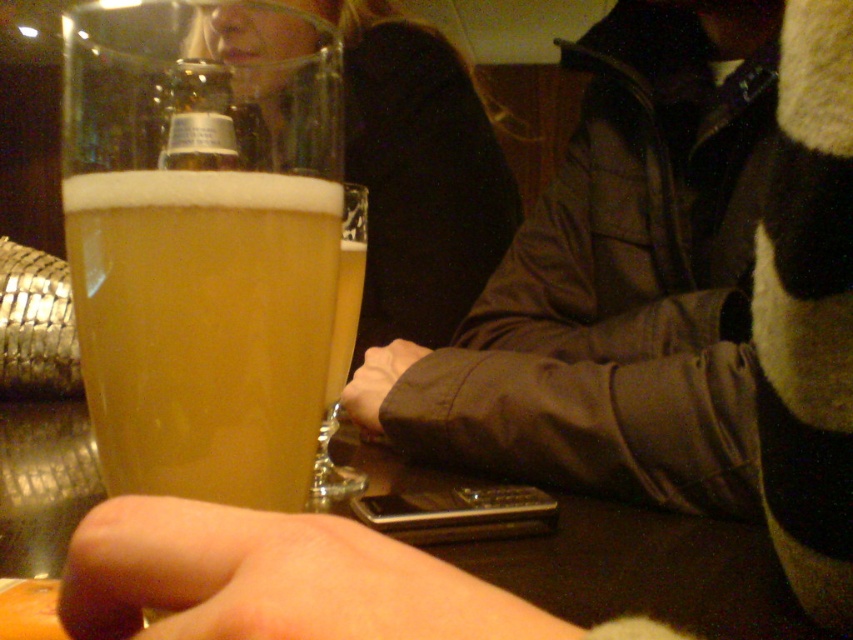
Question: Which point is closer to the camera?

Choices:
 (A) matte black hand at center
 (B) golden matte glass at center
 (C) skinny flesh-toned hand at lower left

Answer: (C)

Question: Is black sweater at upper center wider than matte black hand at center?

Choices:
 (A) yes
 (B) no

Answer: (A)

Question: Can you confirm if black sweater at upper center is positioned to the right of matte black hand at center?

Choices:
 (A) no
 (B) yes

Answer: (A)

Question: Does black sweater at upper center have a greater width compared to matte black hand at center?

Choices:
 (A) no
 (B) yes

Answer: (B)

Question: Among these points, which one is farthest from the camera?

Choices:
 (A) (339, 328)
 (B) (277, 188)
 (C) (379, 544)
 (D) (421, 337)

Answer: (D)

Question: Which point is closer to the camera taking this photo?

Choices:
 (A) (164, 589)
 (B) (345, 486)
 (C) (370, 426)

Answer: (A)